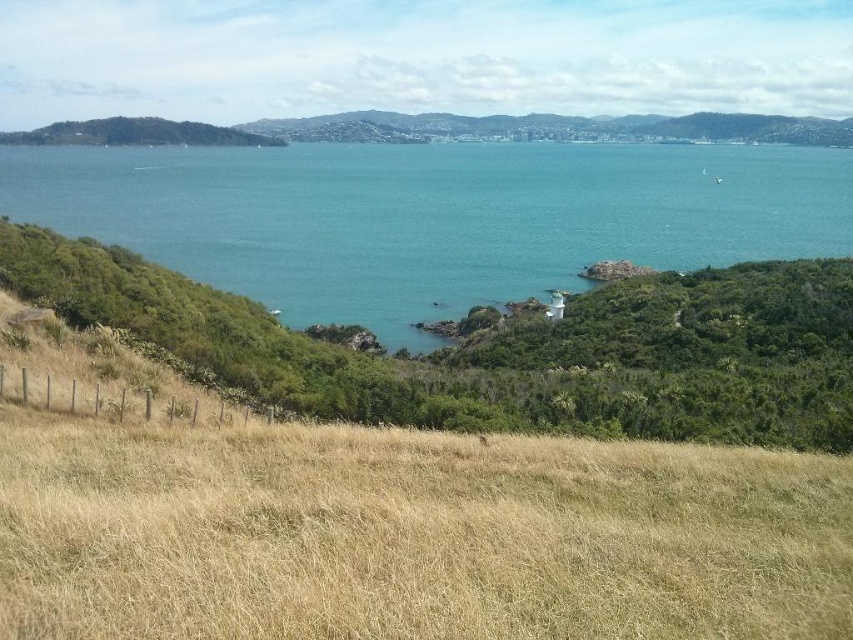
You are standing at the wire fence on the edge of the grassy slope in the coastal landscape. You see two points marked in the scene. Which of the two points, point (195, 244) or point (134, 116), is closer to your current position?

Point (195, 244) is closer to the viewer than point (134, 116), so the point (195, 244) is closer to your current position at the wire fence.

Looking at this image, you are planning to build a small boat dock. You have two materials, one suitable for areas wider than 10 meters and another for narrower areas. Based on the scene, which material should you choose for the blue water at center and the green grassy hillside at upper left?

The blue water at center is wider than the green grassy hillside at upper left. Therefore, the blue water at center requires the material for wider areas over 10 meters, while the green grassy hillside at upper left needs the material for narrower areas under 10 meters.

You are standing at the top of the green grassy hillside at upper left and want to walk to the blue water at center. Which direction should you head towards?

You should head towards the direction of the blue water at center, which is in front of the green grassy hillside at upper left, so you need to walk down the slope towards the water.